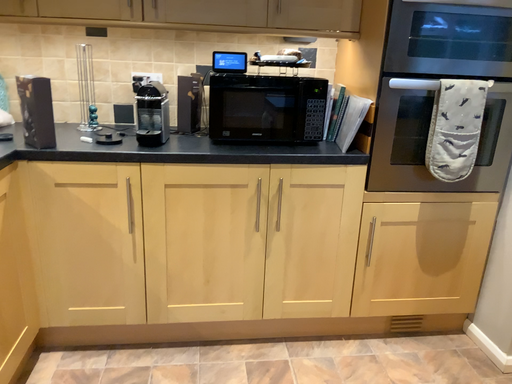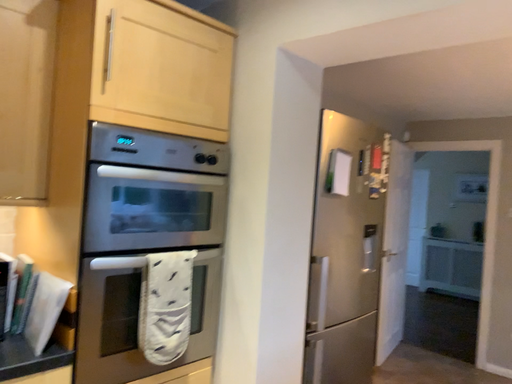
Question: How did the camera likely rotate when shooting the video?

Choices:
 (A) rotated left
 (B) rotated right

Answer: (B)